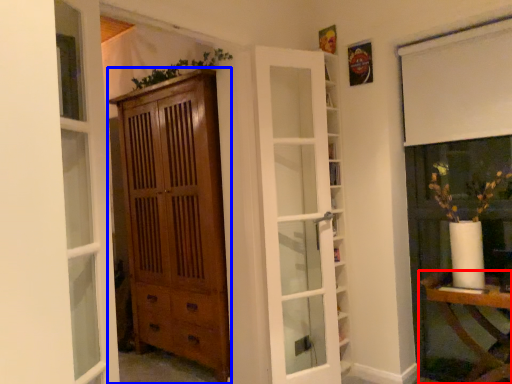
Question: Which object appears farthest to the camera in this image, table (highlighted by a red box) or cabinetry (highlighted by a blue box)?

Choices:
 (A) table
 (B) cabinetry

Answer: (B)